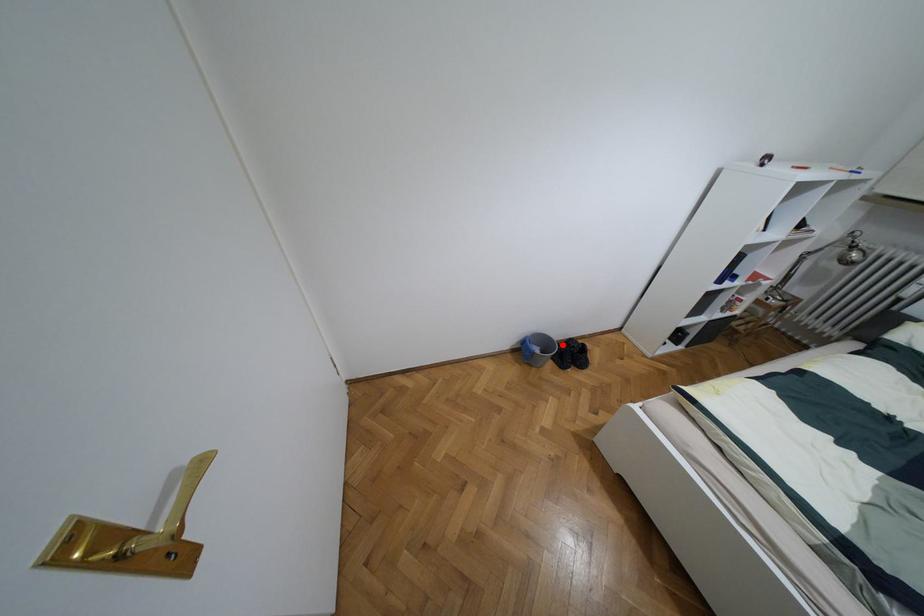
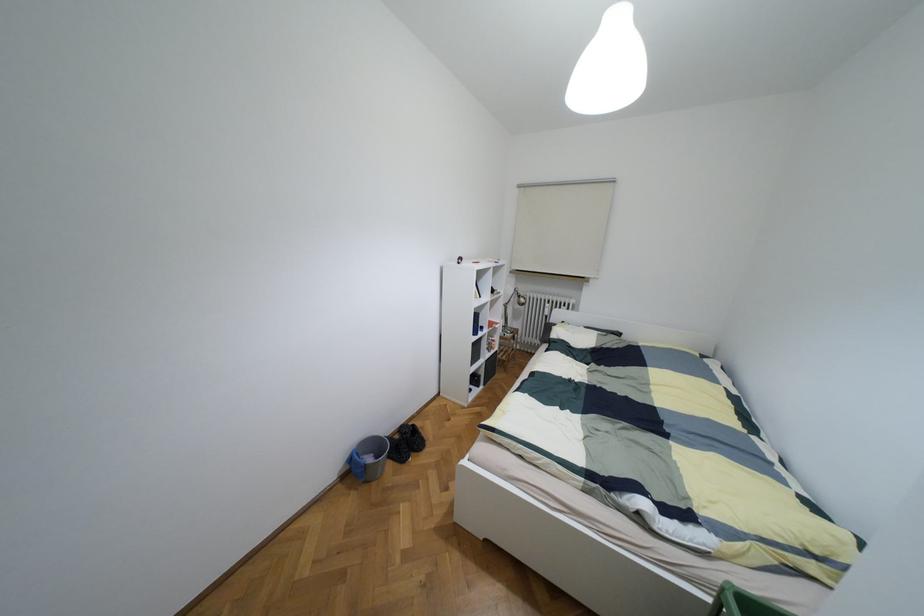
The point at the highlighted location is marked in the first image. Where is the corresponding point in the second image?

(395, 436)